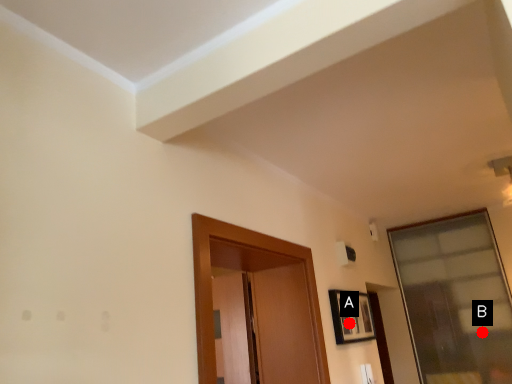
Question: Two points are circled on the image, labeled by A and B beside each circle. Which point is closer to the camera?

Choices:
 (A) A is closer
 (B) B is closer

Answer: (A)